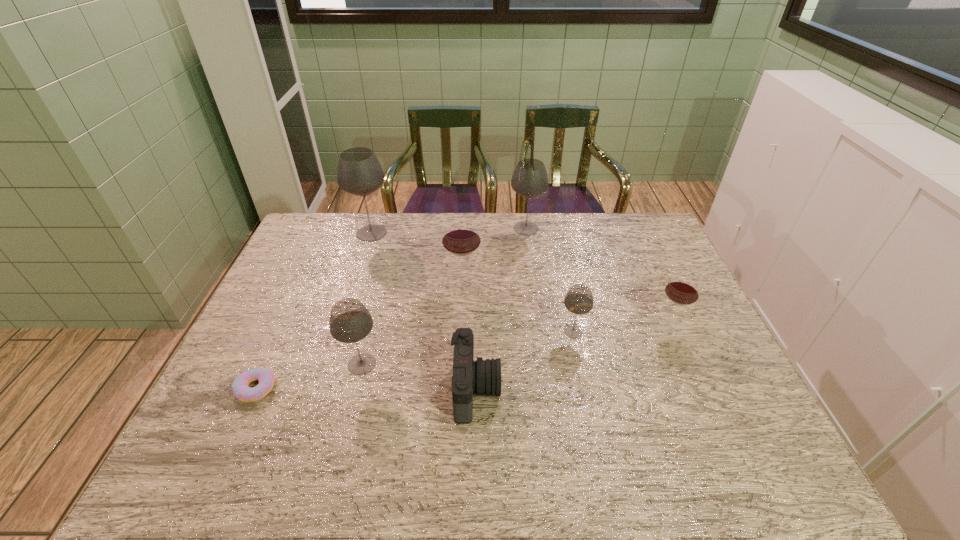
Locate which gray wineglass is the second closest to the doughnut. Please provide its 2D coordinates. Your answer should be formatted as a tuple, i.e. [(x, y)], where the tuple contains the x and y coordinates of a point satisfying the conditions above.

[(359, 172)]

At what (x,y) coordinates should I click in order to perform the action: click on free space that satisfies the following two spatial constraints: 1. on the back side of the nearest wineglass; 2. on the right side of the fourth wineglass from right to left. Please return your answer as a coordinate pair (x, y). Image resolution: width=960 pixels, height=540 pixels. Looking at the image, I should click on (382, 282).

Locate an element on the screen. The height and width of the screenshot is (540, 960). blank space that satisfies the following two spatial constraints: 1. on the back side of the leftmost object; 2. on the left side of the farther red wineglass is located at coordinates (303, 282).

The image size is (960, 540). In order to click on blank area in the image that satisfies the following two spatial constraints: 1. on the back side of the nearest gray wineglass; 2. on the left side of the leftmost object in this screenshot , I will do point(266,364).